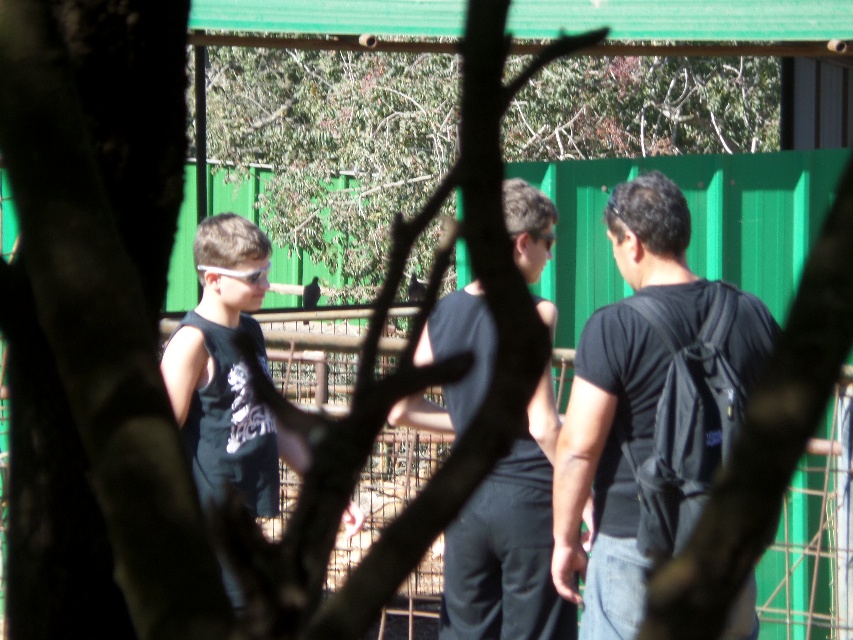
You are standing behind a tree and looking at the scene. There is a black matte backpack at right. Can you see the point located at coordinates (647, 404) on the backpack?

Yes, the point at coordinates (647, 404) is on the black matte backpack at right, so it is visible from your vantage point behind the tree.

You are standing behind a tree and looking at two points in the scene. The first point is at coordinates point [457,616] and the second point is at point [234,596]. Which point is closer to you?

Point [457,616] is further to the viewer than point [234,596], so the second point is closer to you.

You are trying to identify which object is nearer to you in the scene. The black matte backpack at right and the black matte tank top at left are both visible. Based on the scene description, which one is closer to your viewpoint?

The black matte backpack at right is closer to the viewer than the black matte tank top at left.